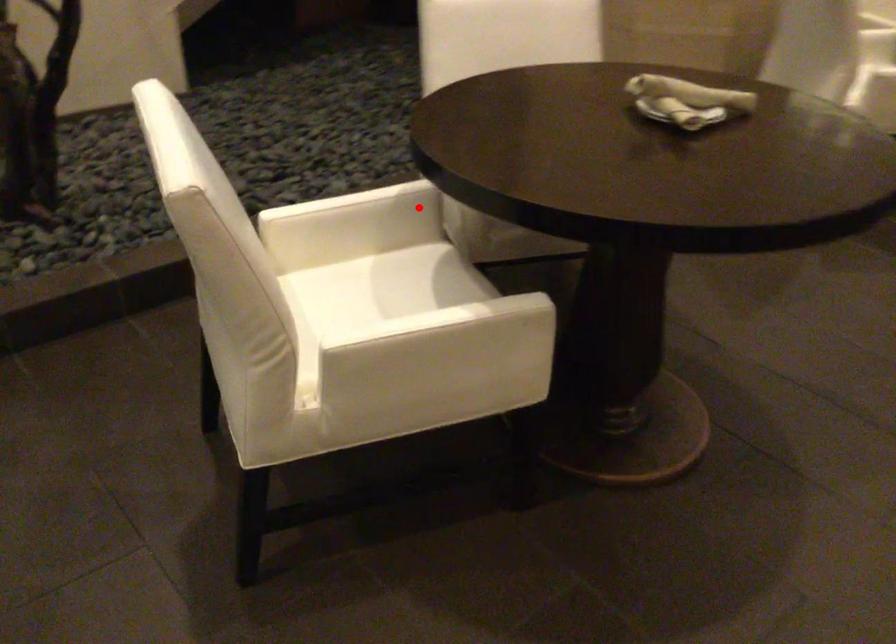
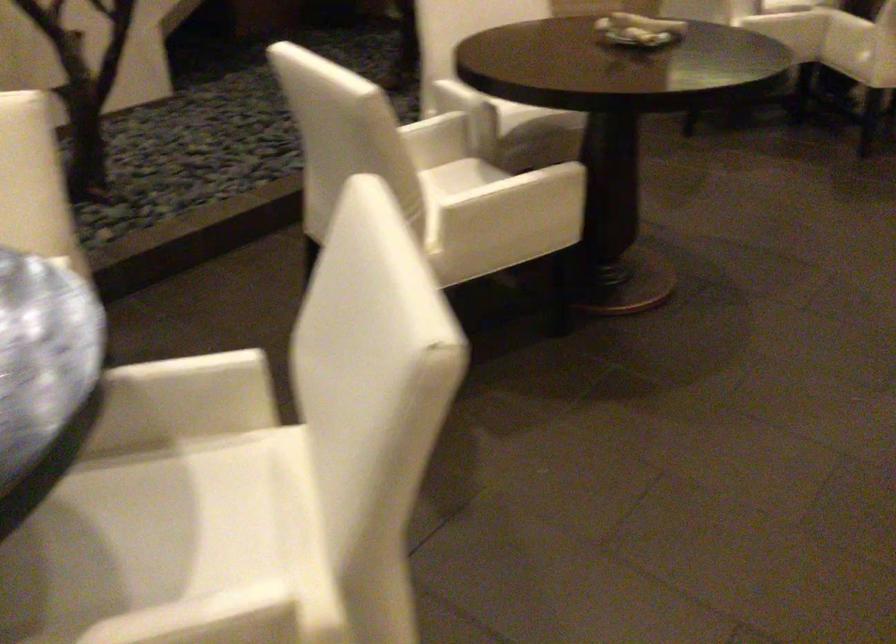
Where in the second image is the point corresponding to the highlighted location from the first image?

(453, 129)